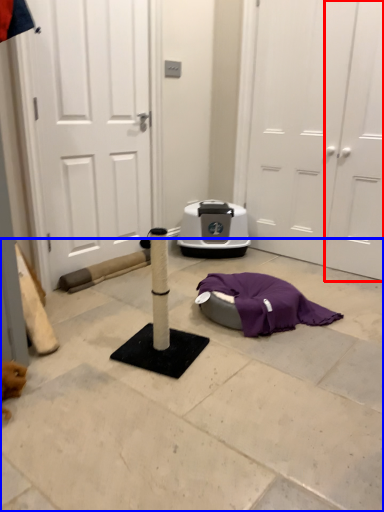
Question: Among these objects, which one is farthest to the camera, door (highlighted by a red box) or concrete (highlighted by a blue box)?

Choices:
 (A) door
 (B) concrete

Answer: (A)